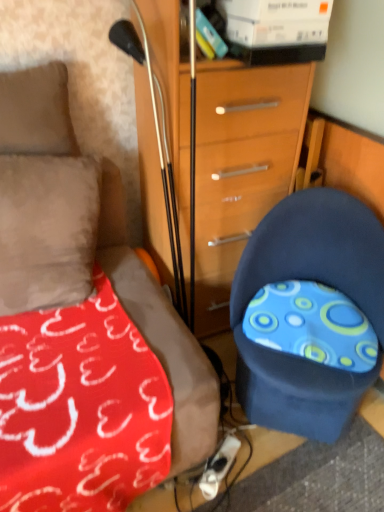
Question: Is wooden chest of drawers at center to the right of blue fabric chair at lower right from the viewer's perspective?

Choices:
 (A) yes
 (B) no

Answer: (B)

Question: From the image's perspective, is wooden chest of drawers at center under blue fabric chair at lower right?

Choices:
 (A) no
 (B) yes

Answer: (A)

Question: Is wooden chest of drawers at center facing towards blue fabric chair at lower right?

Choices:
 (A) yes
 (B) no

Answer: (A)

Question: Considering the relative sizes of wooden chest of drawers at center and blue fabric chair at lower right in the image provided, is wooden chest of drawers at center taller than blue fabric chair at lower right?

Choices:
 (A) no
 (B) yes

Answer: (B)

Question: Does wooden chest of drawers at center come in front of blue fabric chair at lower right?

Choices:
 (A) yes
 (B) no

Answer: (B)

Question: Is suede-like beige pillow at upper left inside or outside of wooden chest of drawers at center?

Choices:
 (A) outside
 (B) inside

Answer: (A)

Question: Is suede-like beige pillow at upper left in front of or behind wooden chest of drawers at center in the image?

Choices:
 (A) front
 (B) behind

Answer: (B)

Question: In terms of size, does suede-like beige pillow at upper left appear bigger or smaller than wooden chest of drawers at center?

Choices:
 (A) small
 (B) big

Answer: (A)

Question: From their relative heights in the image, would you say suede-like beige pillow at upper left is taller or shorter than wooden chest of drawers at center?

Choices:
 (A) short
 (B) tall

Answer: (A)

Question: Is suede-like beige pillow at upper left wider or thinner than blue fabric chair at lower right?

Choices:
 (A) thin
 (B) wide

Answer: (A)

Question: In the image, is suede-like beige pillow at upper left positioned in front of or behind blue fabric chair at lower right?

Choices:
 (A) front
 (B) behind

Answer: (B)

Question: Is suede-like beige pillow at upper left to the left or to the right of blue fabric chair at lower right in the image?

Choices:
 (A) right
 (B) left

Answer: (B)

Question: Considering the positions of suede-like beige pillow at upper left and blue fabric chair at lower right in the image, is suede-like beige pillow at upper left taller or shorter than blue fabric chair at lower right?

Choices:
 (A) tall
 (B) short

Answer: (B)

Question: Based on their sizes in the image, would you say blue fabric chair at lower right is bigger or smaller than suede-like beige pillow at upper left?

Choices:
 (A) small
 (B) big

Answer: (B)

Question: Would you say blue fabric chair at lower right is inside or outside suede-like beige pillow at upper left?

Choices:
 (A) inside
 (B) outside

Answer: (B)